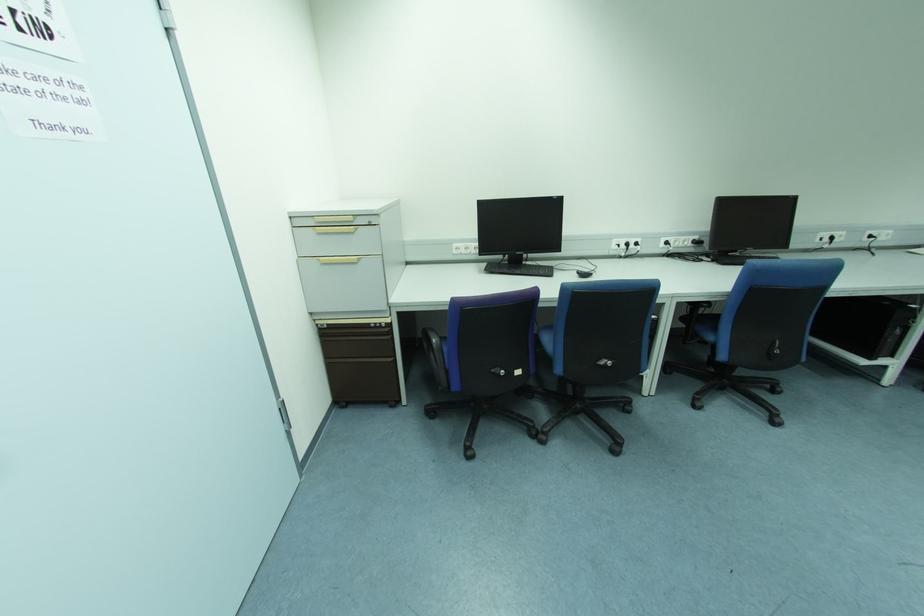
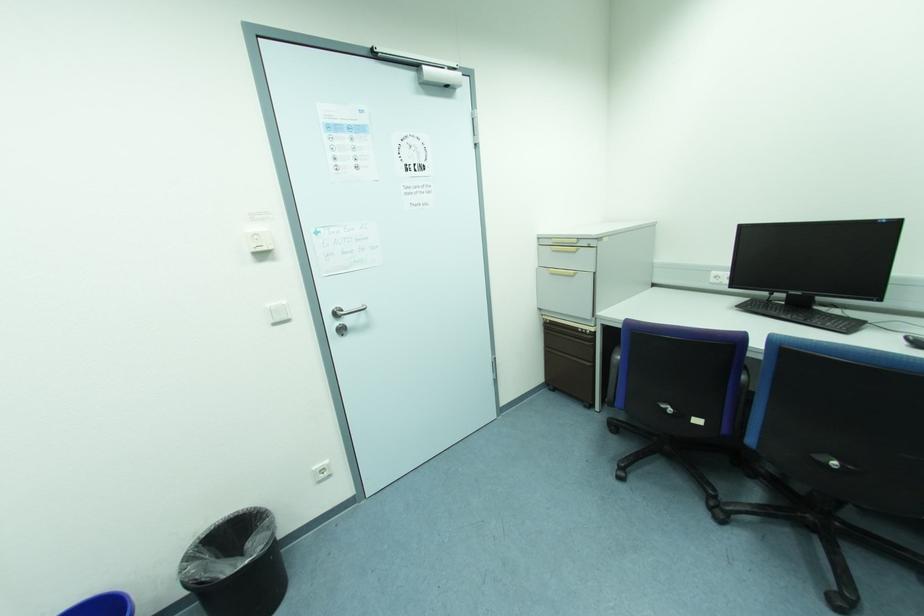
Question: Based on the continuous images, in which direction is the camera rotating? Reply with the corresponding letter.

Choices:
 (A) Left
 (B) Right
 (C) Up
 (D) Down

Answer: (A)